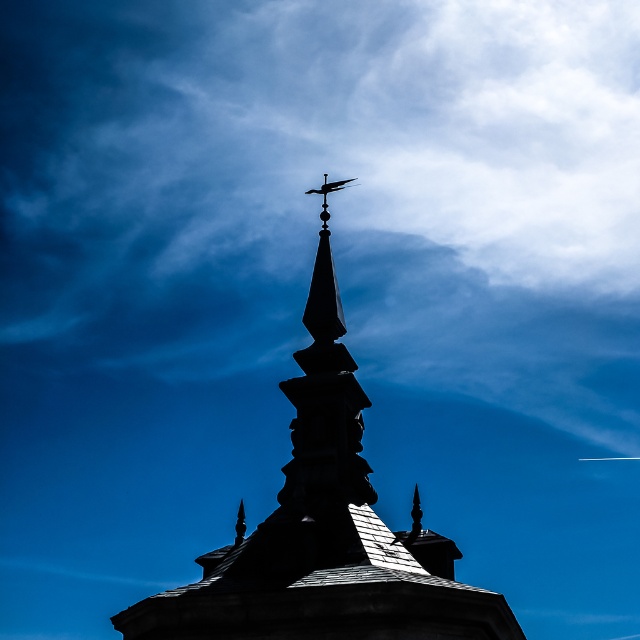
Based on the photo, you are a drone operator who needs to fly a drone from the silhouette stone tower at center to the blue sky at upper center. What is the vertical distance you need to cover?

The vertical distance between the silhouette stone tower at center and the blue sky at upper center is 37.19 meters.